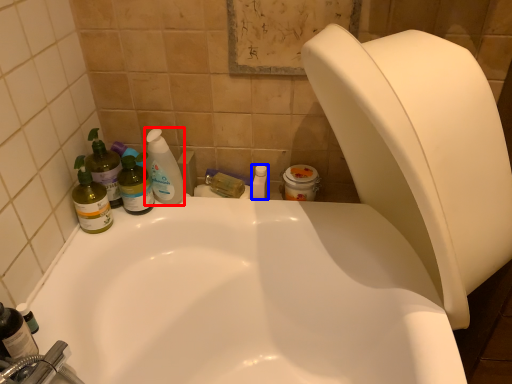
Question: Which object is closer to the camera taking this photo, cleaning product (highlighted by a red box) or toiletry (highlighted by a blue box)?

Choices:
 (A) cleaning product
 (B) toiletry

Answer: (A)